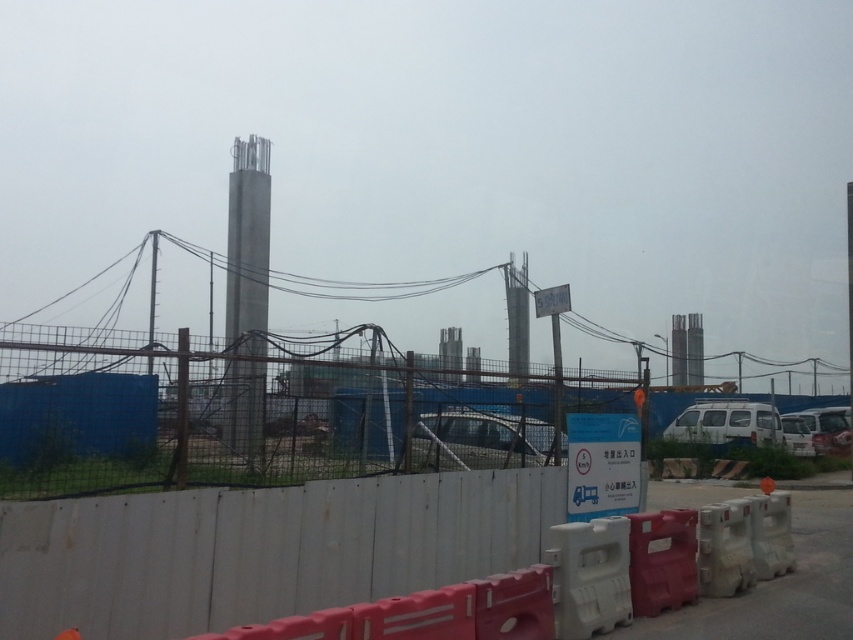
You are a delivery driver approaching the construction site. You need to park your silver metallic car at center near the blue mesh fence at lower left. Can your car fit between them if the space between them is exactly the size of your car?

The blue mesh fence at lower left is bigger than the silver metallic car at center, but the question states the space between them is exactly the size of your car. Therefore, the silver metallic car at center can fit in the space between them.